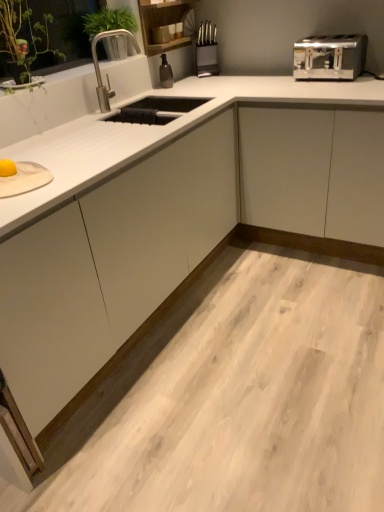
Question: Can you confirm if satin silver toaster at upper right is positioned to the left of green leafy plant at upper left?

Choices:
 (A) no
 (B) yes

Answer: (A)

Question: Can we say satin silver toaster at upper right lies outside green leafy plant at upper left?

Choices:
 (A) yes
 (B) no

Answer: (A)

Question: Can you confirm if satin silver toaster at upper right is wider than green leafy plant at upper left?

Choices:
 (A) no
 (B) yes

Answer: (B)

Question: Considering the relative sizes of satin silver toaster at upper right and green leafy plant at upper left in the image provided, is satin silver toaster at upper right taller than green leafy plant at upper left?

Choices:
 (A) yes
 (B) no

Answer: (B)

Question: From the image's perspective, would you say satin silver toaster at upper right is positioned over green leafy plant at upper left?

Choices:
 (A) yes
 (B) no

Answer: (B)

Question: Is satin silver toaster at upper right directly adjacent to green leafy plant at upper left?

Choices:
 (A) no
 (B) yes

Answer: (A)

Question: Does polished stainless steel faucet at upper left have a greater height compared to satin silver toaster at upper right?

Choices:
 (A) no
 (B) yes

Answer: (B)

Question: Is polished stainless steel faucet at upper left positioned beyond the bounds of satin silver toaster at upper right?

Choices:
 (A) yes
 (B) no

Answer: (A)

Question: Would you say polished stainless steel faucet at upper left contains satin silver toaster at upper right?

Choices:
 (A) yes
 (B) no

Answer: (B)

Question: Can you confirm if polished stainless steel faucet at upper left is shorter than satin silver toaster at upper right?

Choices:
 (A) yes
 (B) no

Answer: (B)

Question: From the image's perspective, is polished stainless steel faucet at upper left under satin silver toaster at upper right?

Choices:
 (A) yes
 (B) no

Answer: (A)

Question: From a real-world perspective, is polished stainless steel faucet at upper left physically above satin silver toaster at upper right?

Choices:
 (A) no
 (B) yes

Answer: (B)

Question: Considering the relative sizes of satin silver toaster at upper right and polished stainless steel faucet at upper left in the image provided, is satin silver toaster at upper right taller than polished stainless steel faucet at upper left?

Choices:
 (A) no
 (B) yes

Answer: (A)